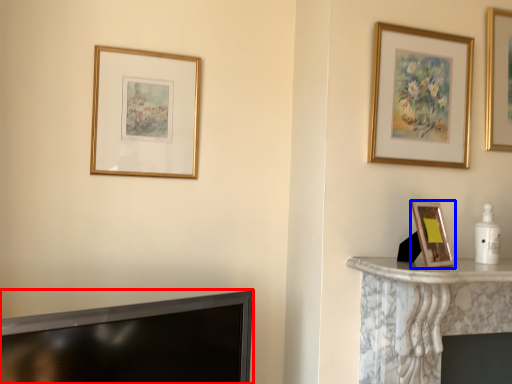
Question: Which object is further to the camera taking this photo, television (highlighted by a red box) or picture frame (highlighted by a blue box)?

Choices:
 (A) television
 (B) picture frame

Answer: (B)